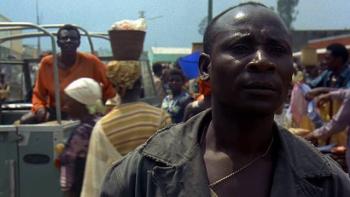
Locate an element on the screen. The image size is (350, 197). blue bucket is located at coordinates tap(188, 62).